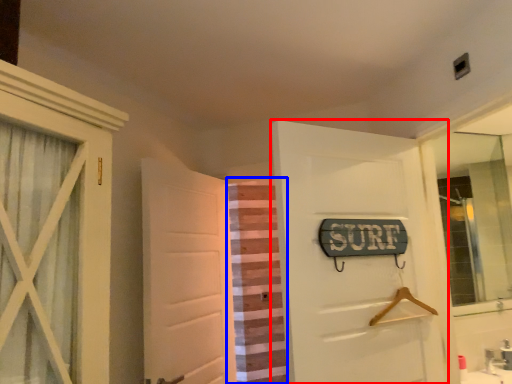
Question: Among these objects, which one is farthest to the camera, door (highlighted by a red box) or curtain (highlighted by a blue box)?

Choices:
 (A) door
 (B) curtain

Answer: (B)